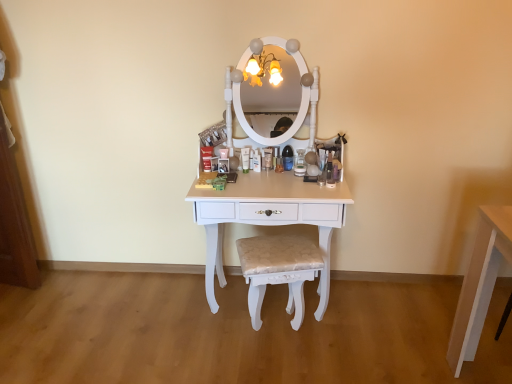
Image resolution: width=512 pixels, height=384 pixels. Find the location of `free location in front of beige fabric cushioned stool at center`. free location in front of beige fabric cushioned stool at center is located at coordinates (283, 364).